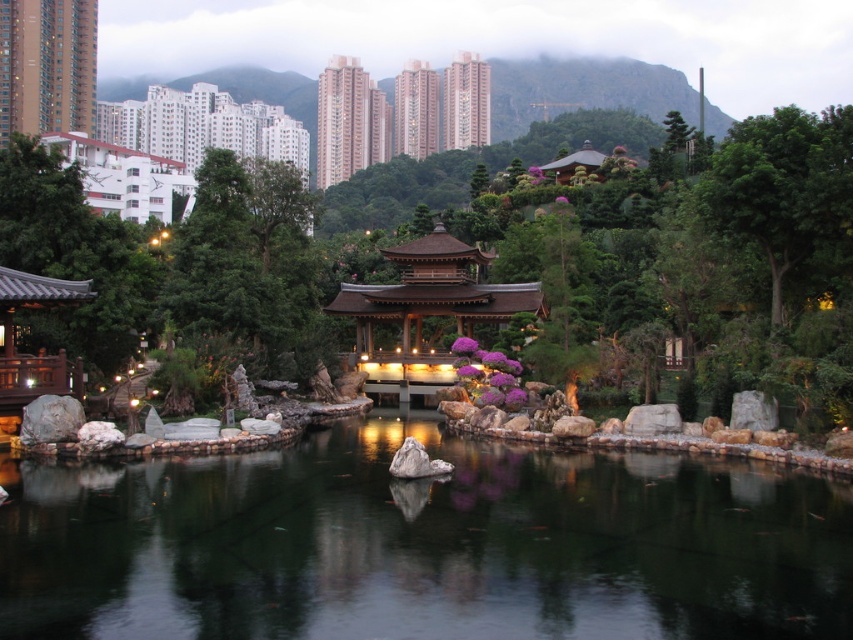
Question: Can you confirm if green matte tree at center is thinner than green matte tree at upper left?

Choices:
 (A) no
 (B) yes

Answer: (B)

Question: Which object is the closest to the transparent water at center?

Choices:
 (A) matte brown temple at upper left
 (B) pink concrete temple at upper center
 (C) green leafy tree at upper right
 (D) green matte tree at center

Answer: (C)

Question: Which point is farther to the camera?

Choices:
 (A) pink concrete temple at upper center
 (B) transparent water at center
 (C) green leafy tree at upper right
 (D) green matte tree at upper left

Answer: (A)

Question: Does green matte tree at upper left lie behind green leafy tree at upper right?

Choices:
 (A) no
 (B) yes

Answer: (B)

Question: Is transparent water at center smaller than green matte tree at upper left?

Choices:
 (A) yes
 (B) no

Answer: (A)

Question: Which object is the closest to the matte brown temple at upper left?

Choices:
 (A) green leafy tree at upper right
 (B) green matte tree at center
 (C) pink concrete temple at upper center

Answer: (C)